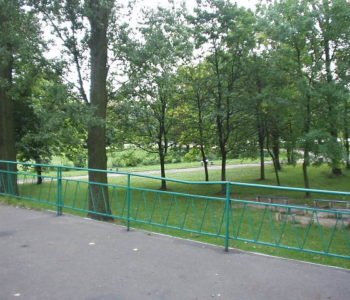
Find the location of a particular element. handrail is located at coordinates [x=8, y=161], [x=129, y=173], [x=298, y=188].